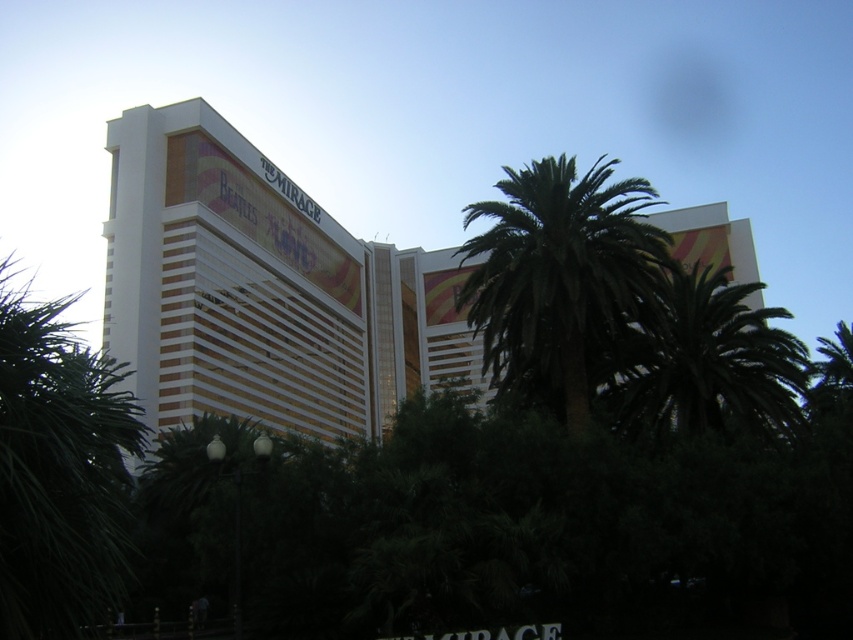
You are standing in front of The Mirage building and want to take a photo. You notice two points marked on the building facade at coordinates point [73,467] and point [775,435]. Which point will appear larger in your photo?

Point [73,467] is closer to the camera than point [775,435], so it will appear larger in the photo.

You are a photographer trying to capture both the white glossy building at center and the green leafy palm at center in a single frame. Given their sizes, which object will appear larger in your photo?

The white glossy building at center will appear larger in the photo because it is bigger than the green leafy palm at center according to the description.